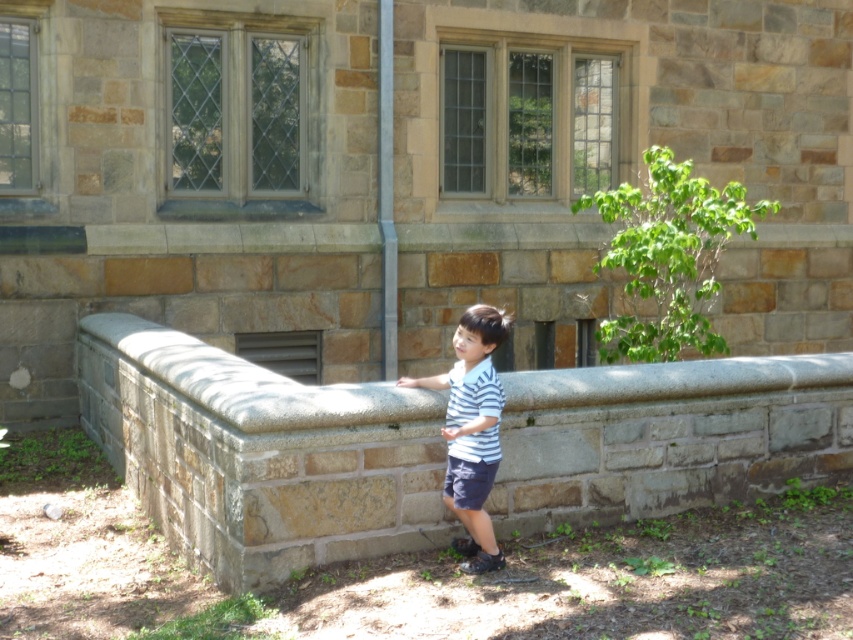
You are a photographer trying to capture the striped cotton shirt at center and the gray stone ledge at center in the same frame. Based on their positions, which object is closer to the left edge of the photo?

The gray stone ledge at center is positioned on the left side of striped cotton shirt at center, so it is closer to the left edge of the photo.

You are a photographer trying to capture the striped cotton shirt at center and the gray stone ledge at center in the same frame. Based on their positions, which object should you focus on first to ensure both are in the shot?

The gray stone ledge at center is located below the striped cotton shirt at center, so you should focus on the striped cotton shirt at center first to ensure both are in the shot.

You are a photographer trying to capture the striped cotton shirt at center and the gray stone ledge at center in the same frame. Which object should you focus on first if you want to ensure both are in focus?

You should focus on the gray stone ledge at center first because the striped cotton shirt at center is behind it, so adjusting focus starting from the closer object will help both be in focus.